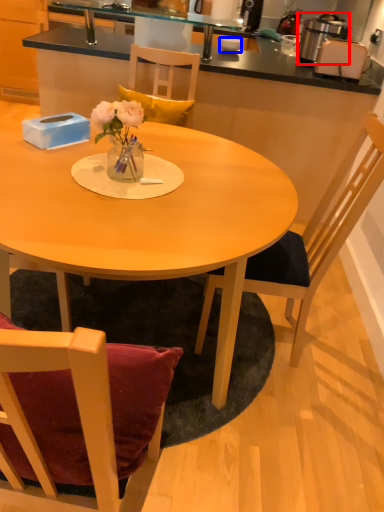
Question: Which point is further to the camera, kitchen appliance (highlighted by a red box) or coffee cup (highlighted by a blue box)?

Choices:
 (A) kitchen appliance
 (B) coffee cup

Answer: (B)